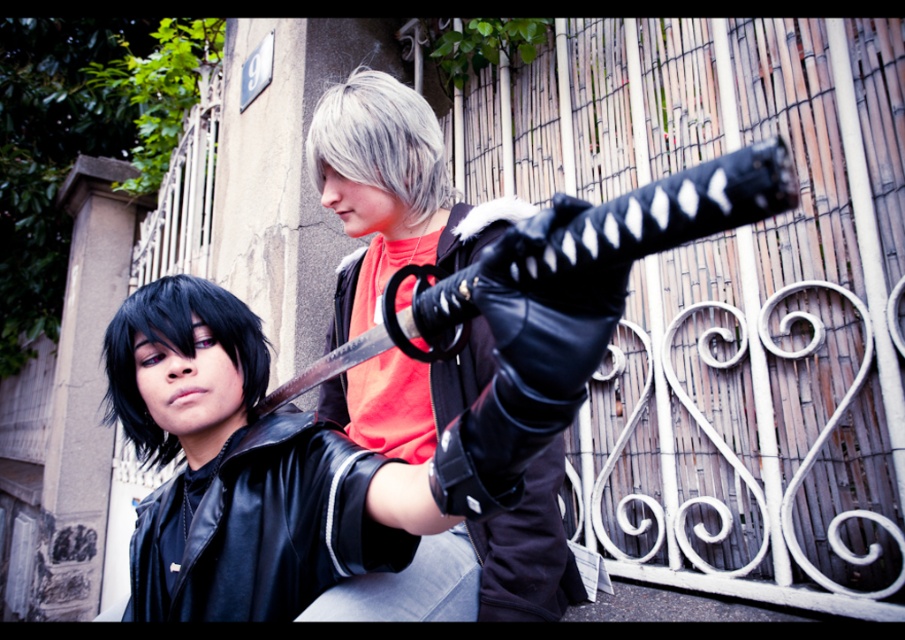
Question: Among these objects, which one is nearest to the camera?

Choices:
 (A) black leather jacket at center
 (B) black leather glove at center

Answer: (A)

Question: Based on their relative distances, which object is nearer to the black leather glove at center?

Choices:
 (A) silverhair at center
 (B) black matte hair at center

Answer: (A)

Question: Is black leather glove at center to the left of black leather jacket at center from the viewer's perspective?

Choices:
 (A) yes
 (B) no

Answer: (B)

Question: Considering the relative positions of black leather glove at center and black matte hair at center in the image provided, where is black leather glove at center located with respect to black matte hair at center?

Choices:
 (A) left
 (B) right

Answer: (B)

Question: Does black leather glove at center appear on the left side of silverhair at center?

Choices:
 (A) no
 (B) yes

Answer: (A)

Question: Which is farther from the black leather glove at center?

Choices:
 (A) silverhair at center
 (B) black leather jacket at center

Answer: (B)